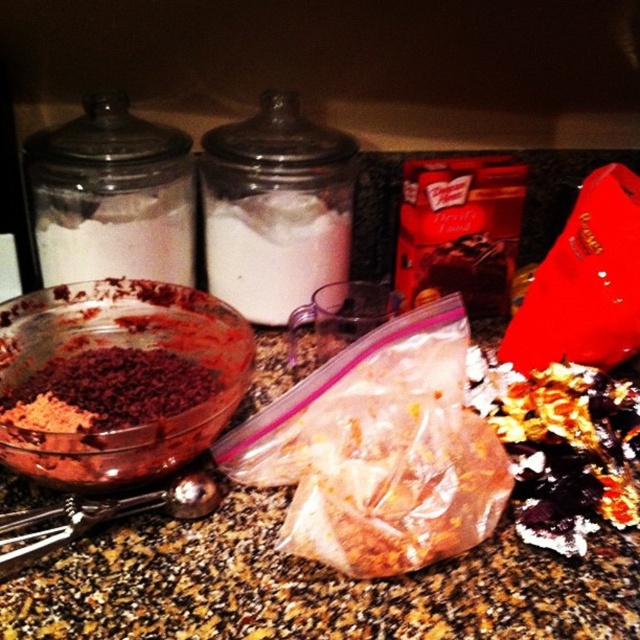
Is point (60, 323) positioned before point (285, 246)?

That is True.

Between point (108, 416) and point (317, 205), which one is positioned in front?

Point (108, 416) is in front.

Identify the location of translucent glass bowl at center-left. (116, 380).

Where is `translucent glass bowl at center-left`? translucent glass bowl at center-left is located at coordinates (116, 380).